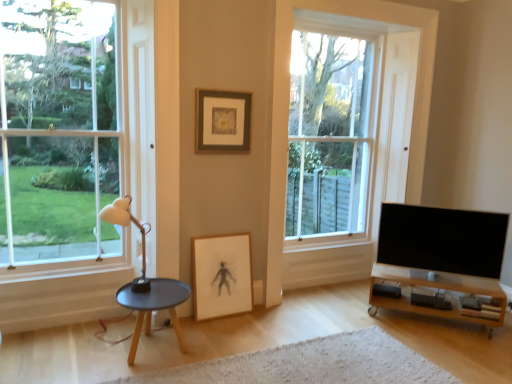
Question: From the image's perspective, is black glossy tv at lower right located above or below wooden tv stand at lower right?

Choices:
 (A) above
 (B) below

Answer: (A)

Question: Is black glossy tv at lower right wider or thinner than wooden tv stand at lower right?

Choices:
 (A) wide
 (B) thin

Answer: (B)

Question: Estimate the real-world distances between objects in this image. Which object is farther from the white textured rug at lower center?

Choices:
 (A) matte black table at lower left
 (B) wooden tv stand at lower right
 (C) white matte lamp at left
 (D) wooden framed drawing at center, arranged as the first picture frame when ordered from the bottom
 (E) clear glass window at left, which is the 2th window from back to front

Answer: (E)

Question: Which object is positioned closest to the wooden framed drawing at center, which appears as the 2th picture frame when viewed from the top?

Choices:
 (A) white matte lamp at left
 (B) white textured rug at lower center
 (C) clear glass window at center, which is the 2th window from left to right
 (D) matte black table at lower left
 (E) wooden tv stand at lower right

Answer: (D)